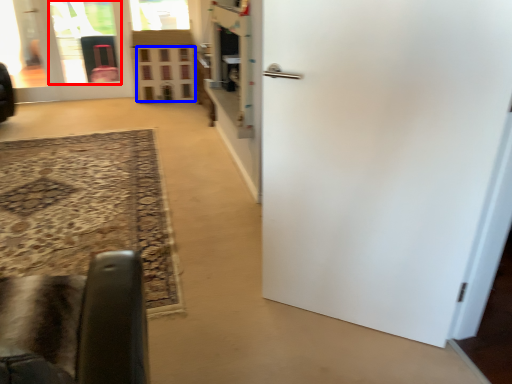
Question: Which object is further to the camera taking this photo, glass door (highlighted by a red box) or window (highlighted by a blue box)?

Choices:
 (A) glass door
 (B) window

Answer: (A)